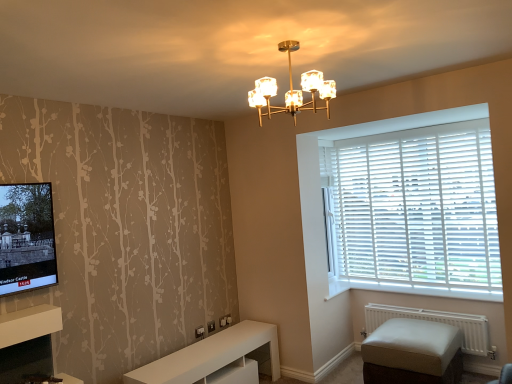
Identify the location of free region under white wood blinds at right (from a real-world perspective). (406, 284).